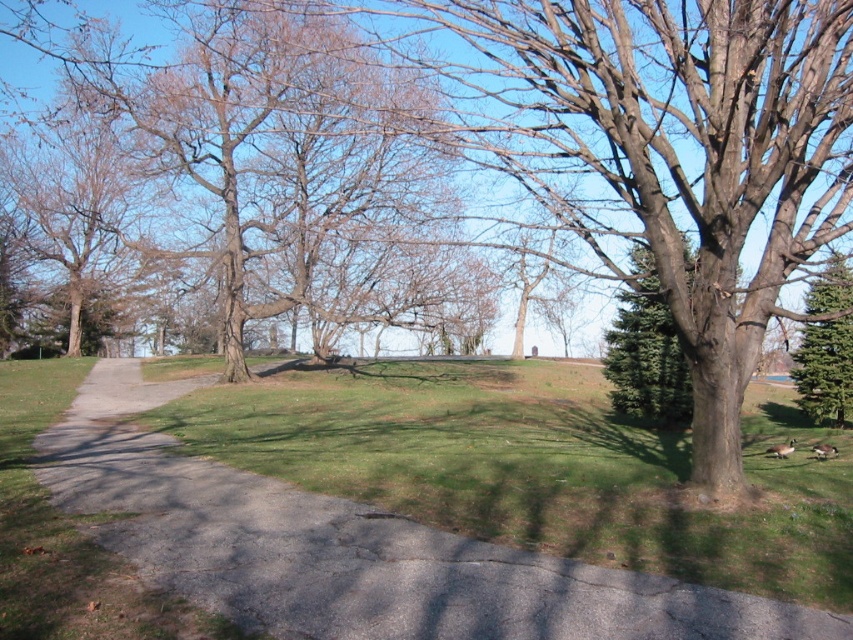
Which is more to the left, gray asphalt path at center or green textured evergreen at right?

Positioned to the left is gray asphalt path at center.

Which is below, gray asphalt path at center or green textured evergreen at right?

Positioned lower is gray asphalt path at center.

This screenshot has width=853, height=640. In order to click on gray asphalt path at center in this screenshot , I will do `click(352, 548)`.

Does green textured evergreen at right have a greater width compared to green textured evergreen tree at right?

Yes, green textured evergreen at right is wider than green textured evergreen tree at right.

Is green textured evergreen at right taller than green textured evergreen tree at right?

Correct, green textured evergreen at right is much taller as green textured evergreen tree at right.

Identify the location of green textured evergreen at right. tap(646, 353).

Which is more to the left, gray asphalt path at center or green textured evergreen tree at right?

gray asphalt path at center

Can you confirm if gray asphalt path at center is positioned to the left of green textured evergreen tree at right?

Yes, gray asphalt path at center is to the left of green textured evergreen tree at right.

Is point (810, 618) farther from camera compared to point (833, 364)?

That is False.

This screenshot has width=853, height=640. Identify the location of gray asphalt path at center. (352, 548).